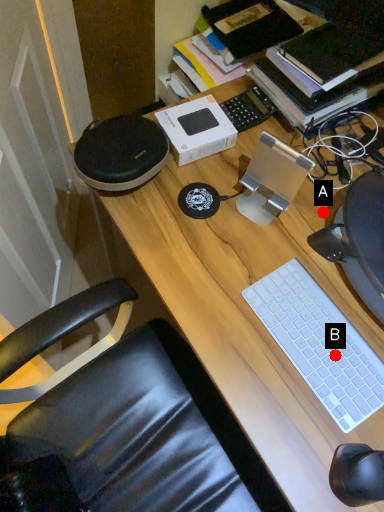
Question: Two points are circled on the image, labeled by A and B beside each circle. Which point is farther to the camera?

Choices:
 (A) A is further
 (B) B is further

Answer: (A)